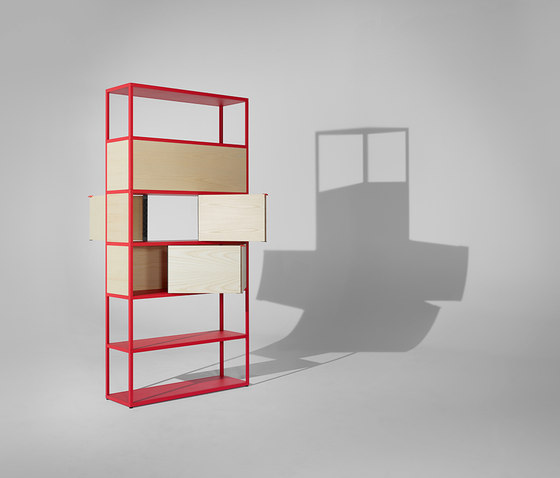
Locate an element on the screen. The width and height of the screenshot is (560, 478). inside of top roof of shelf is located at coordinates (191, 99), (123, 92).